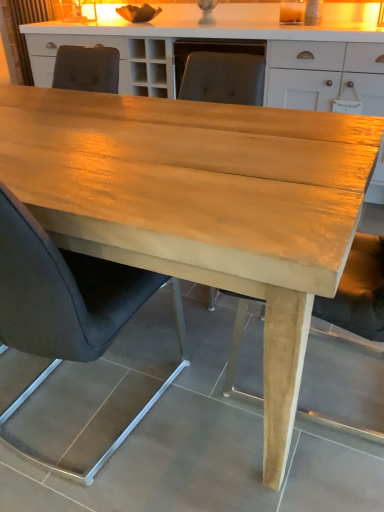
Question: From the image's perspective, is matte brown curtain at upper left positioned above or below matte gray chair at center, the 2th chair when ordered from front to back?

Choices:
 (A) above
 (B) below

Answer: (A)

Question: Based on their sizes in the image, would you say matte brown curtain at upper left is bigger or smaller than matte gray chair at center, the 2th chair when ordered from front to back?

Choices:
 (A) small
 (B) big

Answer: (A)

Question: Which object is positioned closest to the black leather chair at center, marked as the first chair in a front-to-back arrangement?

Choices:
 (A) matte brown curtain at upper left
 (B) matte gray chair at center, the 2th chair when ordered from front to back

Answer: (B)

Question: Which is farther from the black leather chair at center, marked as the second chair in a back-to-front arrangement?

Choices:
 (A) matte brown curtain at upper left
 (B) matte gray chair at center, the first chair viewed from the back

Answer: (A)